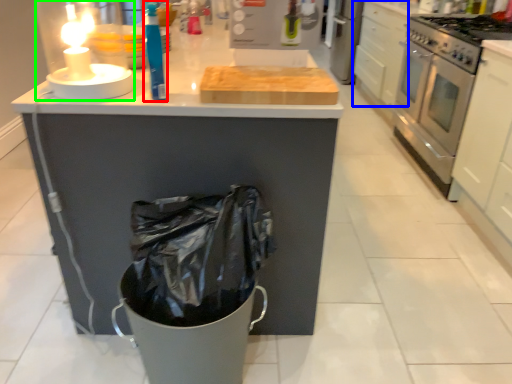
Question: Considering the real-world distances, which object is closest to cleaning product (highlighted by a red box)? drawer (highlighted by a blue box) or candle holder (highlighted by a green box).

Choices:
 (A) drawer
 (B) candle holder

Answer: (B)